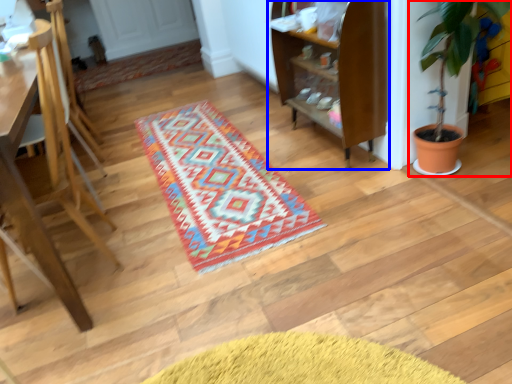
Question: Which of the following is the farthest to the observer, houseplant (highlighted by a red box) or shelf (highlighted by a blue box)?

Choices:
 (A) houseplant
 (B) shelf

Answer: (B)